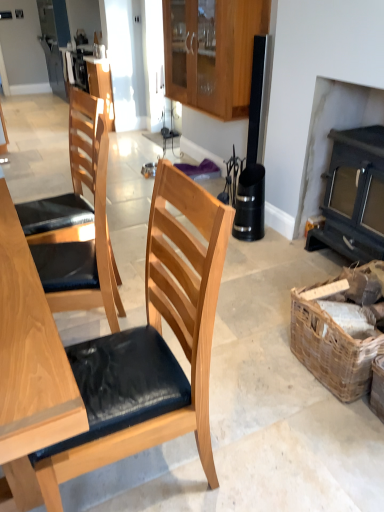
I want to click on empty space that is to the right of wooden chair with cushion at center, the 2th chair viewed from the top, so click(255, 443).